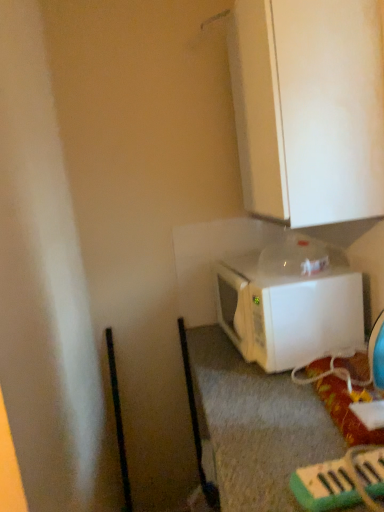
Question: From a real-world perspective, is white matte cabinet at upper center located beneath white matte microwave at lower right?

Choices:
 (A) no
 (B) yes

Answer: (A)

Question: Can you confirm if white matte cabinet at upper center is shorter than white matte microwave at lower right?

Choices:
 (A) yes
 (B) no

Answer: (B)

Question: From the image's perspective, is white matte cabinet at upper center under white matte microwave at lower right?

Choices:
 (A) no
 (B) yes

Answer: (A)

Question: Can white matte microwave at lower right be found inside white matte cabinet at upper center?

Choices:
 (A) no
 (B) yes

Answer: (A)

Question: Is white matte cabinet at upper center far away from white matte microwave at lower right?

Choices:
 (A) no
 (B) yes

Answer: (A)

Question: Considering the relative positions of white matte cabinet at upper center and white matte microwave at lower right in the image provided, is white matte cabinet at upper center to the left of white matte microwave at lower right from the viewer's perspective?

Choices:
 (A) yes
 (B) no

Answer: (B)

Question: Could you tell me if white matte microwave at lower right is facing white matte cabinet at upper center?

Choices:
 (A) yes
 (B) no

Answer: (B)

Question: Is the depth of white matte microwave at lower right greater than that of white matte cabinet at upper center?

Choices:
 (A) yes
 (B) no

Answer: (A)

Question: From the image's perspective, is white matte microwave at lower right below white matte cabinet at upper center?

Choices:
 (A) yes
 (B) no

Answer: (A)

Question: Is white matte microwave at lower right closer to the viewer compared to white matte cabinet at upper center?

Choices:
 (A) no
 (B) yes

Answer: (A)

Question: Is white matte microwave at lower right bigger than white matte cabinet at upper center?

Choices:
 (A) no
 (B) yes

Answer: (A)

Question: Is white matte cabinet at upper center located within white matte microwave at lower right?

Choices:
 (A) yes
 (B) no

Answer: (B)

Question: In terms of width, does white matte microwave at lower right look wider or thinner when compared to white matte cabinet at upper center?

Choices:
 (A) thin
 (B) wide

Answer: (B)